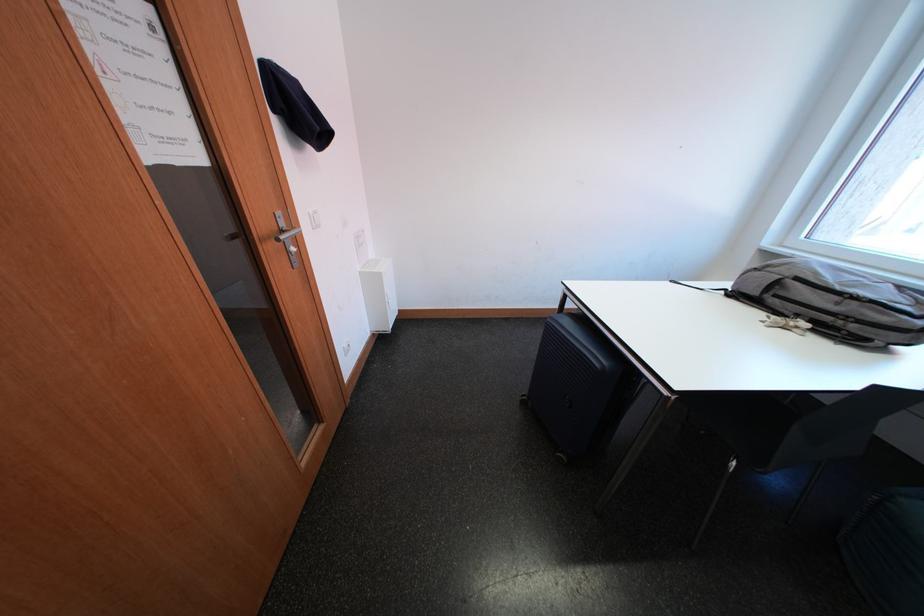
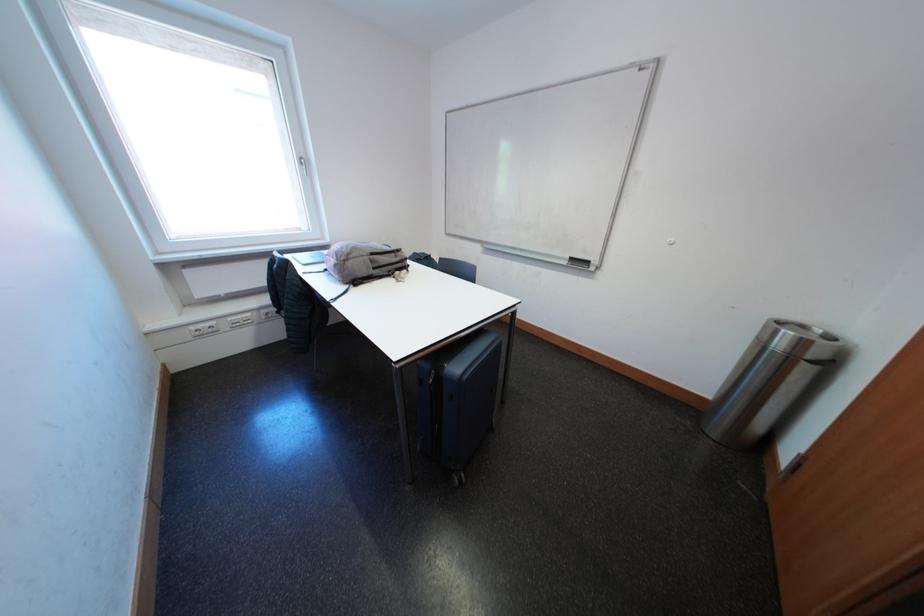
The point at (846, 307) is marked in the first image. Where is the corresponding point in the second image?

(406, 261)